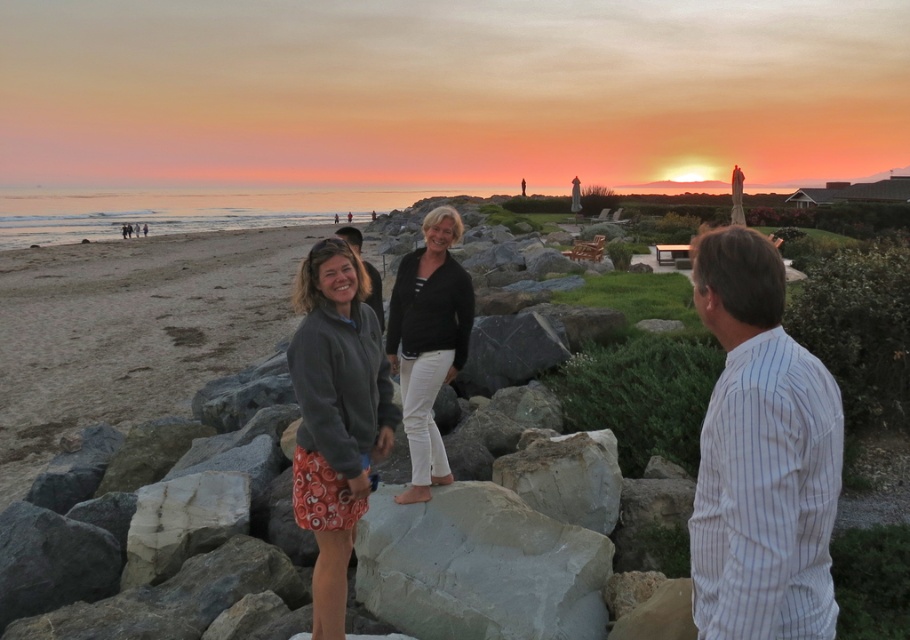
You are a photographer trying to capture the sunset scene. You notice the orange printed skirt at center and the white marble rock at center. Which object should you focus on first if you want to prioritize the one closer to the left side of the frame?

The orange printed skirt at center is to the left of the white marble rock at center, so you should focus on the orange printed skirt at center first as it is closer to the left side of the frame.